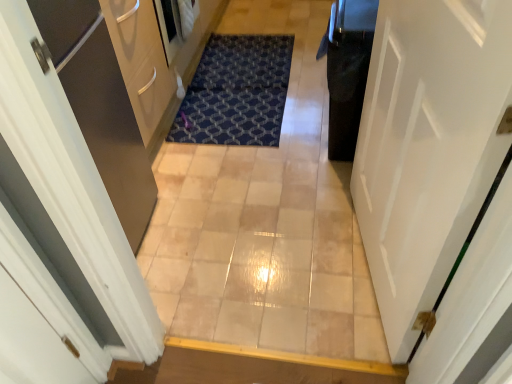
Question: Is black glossy trash can at right positioned behind white glossy door at right?

Choices:
 (A) yes
 (B) no

Answer: (A)

Question: Does black glossy trash can at right touch white glossy door at right?

Choices:
 (A) no
 (B) yes

Answer: (A)

Question: Is black glossy trash can at right facing away from white glossy door at right?

Choices:
 (A) yes
 (B) no

Answer: (B)

Question: From the image's perspective, would you say black glossy trash can at right is shown under white glossy door at right?

Choices:
 (A) yes
 (B) no

Answer: (B)

Question: Considering the relative positions of black glossy trash can at right and white glossy door at right in the image provided, is black glossy trash can at right to the right of white glossy door at right from the viewer's perspective?

Choices:
 (A) no
 (B) yes

Answer: (B)

Question: Considering the relative sizes of black glossy trash can at right and white glossy door at right in the image provided, is black glossy trash can at right thinner than white glossy door at right?

Choices:
 (A) yes
 (B) no

Answer: (B)

Question: From a real-world perspective, is blue textured mat at center physically below black glossy trash can at right?

Choices:
 (A) yes
 (B) no

Answer: (A)

Question: Is blue textured mat at center to the left of black glossy trash can at right from the viewer's perspective?

Choices:
 (A) yes
 (B) no

Answer: (A)

Question: Is the position of blue textured mat at center less distant than that of black glossy trash can at right?

Choices:
 (A) yes
 (B) no

Answer: (B)

Question: Can you confirm if blue textured mat at center is positioned to the right of black glossy trash can at right?

Choices:
 (A) no
 (B) yes

Answer: (A)

Question: Is blue textured mat at center beside black glossy trash can at right?

Choices:
 (A) no
 (B) yes

Answer: (A)

Question: From a real-world perspective, is blue textured mat at center over black glossy trash can at right?

Choices:
 (A) yes
 (B) no

Answer: (B)

Question: Is the position of white glossy door at right less distant than that of beige tile corridor at center?

Choices:
 (A) yes
 (B) no

Answer: (A)